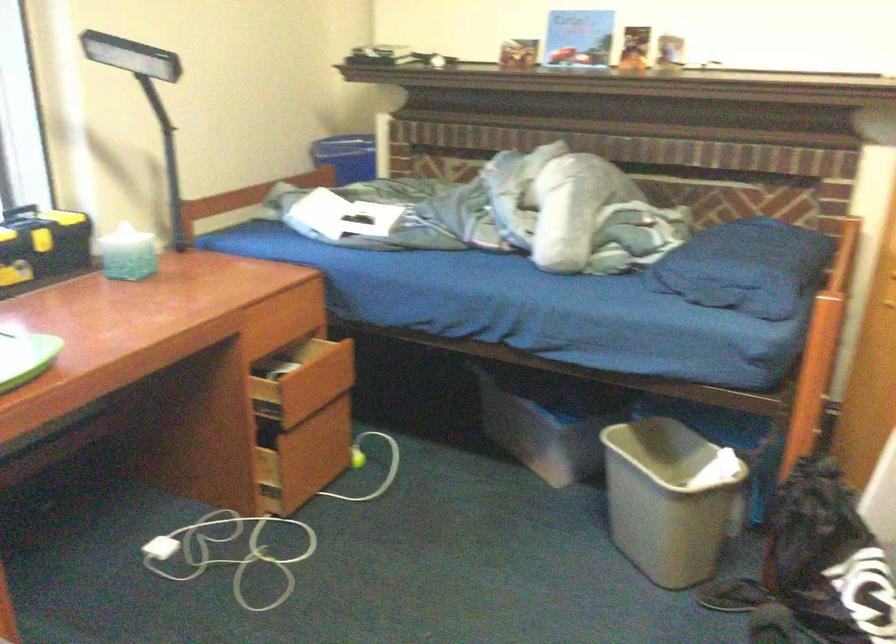
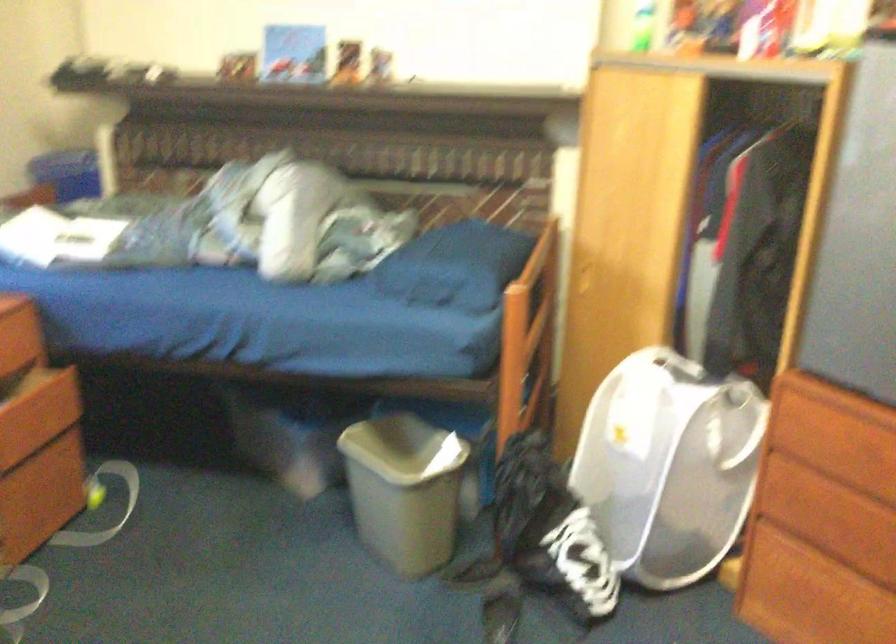
Question: How did the camera likely rotate?

Choices:
 (A) Left
 (B) Right
 (C) Up
 (D) Down

Answer: (B)